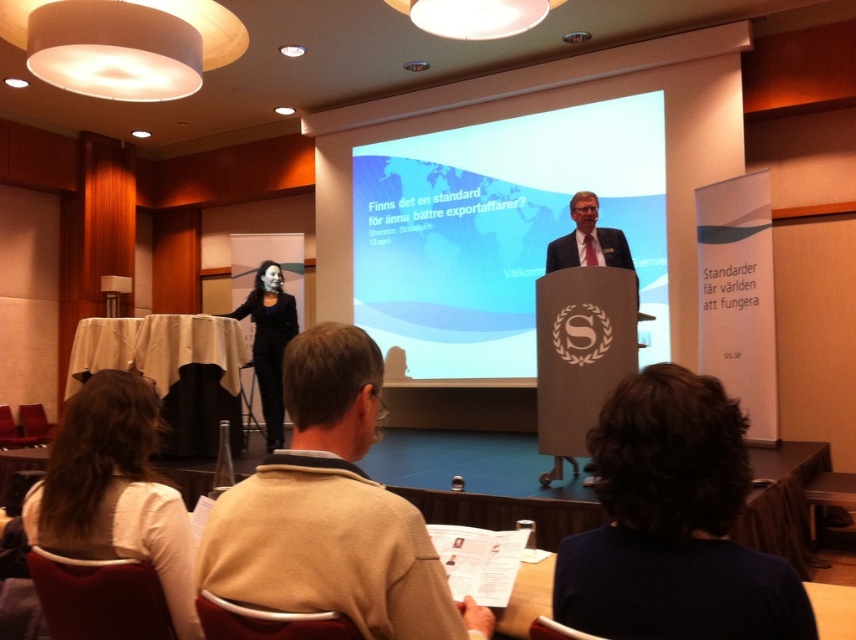
Consider the image. You are standing at the podium on the right side of the room and want to move to the table on the left. There is a point at coordinates [673,524]. Is this point located on the speaker or the assistant?

The point at coordinates [673,524] is located on the dark blue sweater at lower right, which belongs to the speaker standing at the podium on the right side of the room.

You are attending a conference and want to approach the speaker at the podium. You are currently standing near the dark blue sweater at lower right and the black fabric dress at center. Which object should you move away from to get closer to the speaker?

Since the dark blue sweater at lower right is in front of the black fabric dress at center, you should move away from the dark blue sweater at lower right to get closer to the speaker.